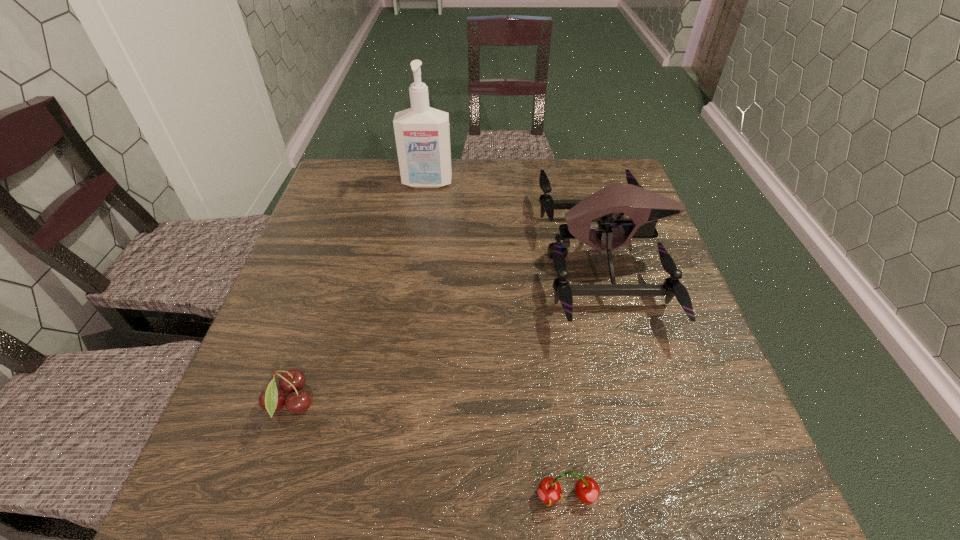
Identify the location of the farthest object. (422, 134).

I want to click on the second object from left to right, so click(422, 134).

Image resolution: width=960 pixels, height=540 pixels. I want to click on drone, so (x=644, y=207).

You are a GUI agent. You are given a task and a screenshot of the screen. Output one action in this format:
    pyautogui.click(x=<x>, y=<y>)
    Task: Click on the second farthest object
    This screenshot has height=540, width=960.
    Given the screenshot: What is the action you would take?
    pyautogui.click(x=644, y=207)

At what (x,y) coordinates should I click in order to perform the action: click on the third farthest object. Please return your answer as a coordinate pair (x, y). Looking at the image, I should click on (271, 400).

Image resolution: width=960 pixels, height=540 pixels. I want to click on the leftmost object, so click(271, 400).

You are a GUI agent. You are given a task and a screenshot of the screen. Output one action in this format:
    pyautogui.click(x=<x>, y=<y>)
    Task: Click on the nearer cherry
    
    Given the screenshot: What is the action you would take?
    pyautogui.click(x=587, y=490)

The height and width of the screenshot is (540, 960). In order to click on the nearest object in this screenshot , I will do `click(587, 490)`.

Identify the location of vacant space located on the front label of the cleansing agent. The width and height of the screenshot is (960, 540). (421, 220).

Locate an element on the screen. free space located 0.080m on the front-facing side of the third nearest object is located at coordinates (510, 258).